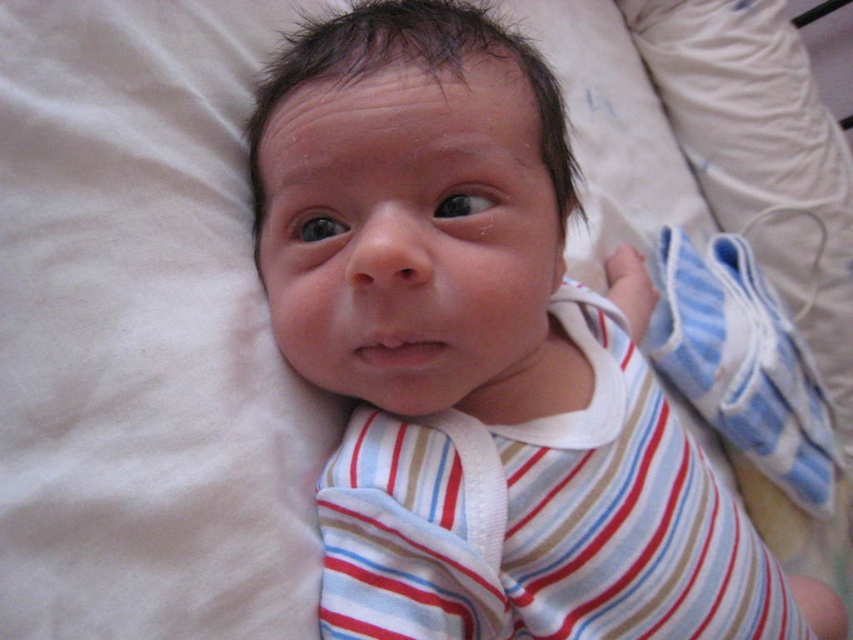
Consider the image. Is striped fabric baby at center below striped cotton shirt at center?

No, striped fabric baby at center is not below striped cotton shirt at center.

Measure the distance between striped fabric baby at center and striped cotton shirt at center.

striped fabric baby at center and striped cotton shirt at center are 4.82 centimeters apart.

Locate an element on the screen. The height and width of the screenshot is (640, 853). striped fabric baby at center is located at coordinates 482,356.